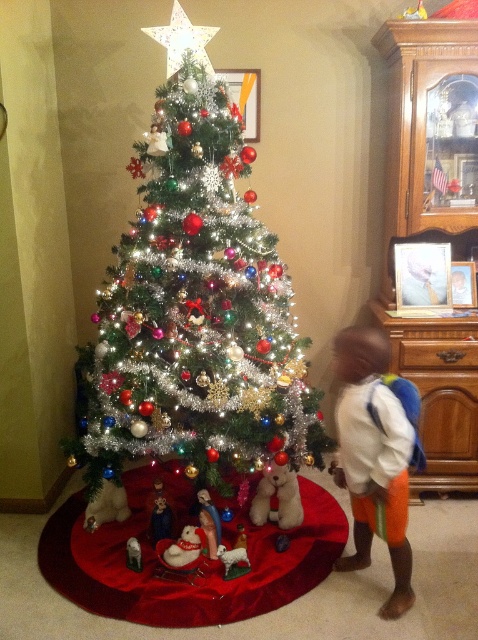
Question: Does shiny silver christmas tree at center appear on the right side of white plush reindeer at lower center?

Choices:
 (A) no
 (B) yes

Answer: (B)

Question: Can you confirm if shiny silver christmas tree at center is smaller than white cotton shirt at center?

Choices:
 (A) no
 (B) yes

Answer: (A)

Question: Which object is the farthest from the fluffy white teddy bear at lower center?

Choices:
 (A) shiny silver christmas tree at center
 (B) white plush reindeer at lower center

Answer: (B)

Question: Among these objects, which one is nearest to the camera?

Choices:
 (A) white plush reindeer at lower center
 (B) shiny silver christmas tree at center
 (C) white cotton shirt at center
 (D) fluffy white teddy bear at lower center

Answer: (C)

Question: Can you confirm if shiny silver christmas tree at center is positioned above fluffy white teddy bear at lower center?

Choices:
 (A) yes
 (B) no

Answer: (A)

Question: Which object appears closest to the camera in this image?

Choices:
 (A) fluffy white teddy bear at lower center
 (B) white cotton shirt at center
 (C) shiny silver christmas tree at center
 (D) white plush reindeer at lower center

Answer: (B)